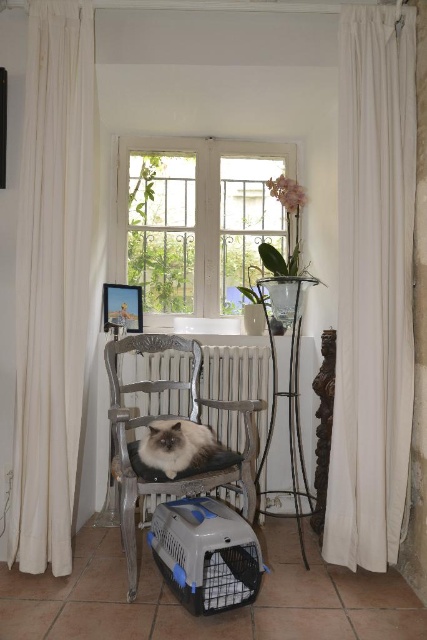
Question: Based on their relative distances, which object is farther from the gray plastic pet carrier at lower center?

Choices:
 (A) white sheer curtain at right
 (B) white sheer curtain at left
 (C) white glass window at center
 (D) white metallic radiator at center

Answer: (C)

Question: Is white sheer curtain at right wider than white glass window at center?

Choices:
 (A) no
 (B) yes

Answer: (A)

Question: Does white sheer curtain at left appear on the left side of gray plastic pet carrier at lower center?

Choices:
 (A) no
 (B) yes

Answer: (B)

Question: Which object is the farthest from the white glass window at center?

Choices:
 (A) white sheer curtain at right
 (B) gray plastic pet carrier at lower center

Answer: (B)

Question: Estimate the real-world distances between objects in this image. Which object is closer to the white sheer curtain at left?

Choices:
 (A) gray plastic pet carrier at lower center
 (B) fluffy gray cat at center
 (C) white glass window at center
 (D) white metallic radiator at center

Answer: (B)

Question: Can you confirm if white sheer curtain at right is positioned below white metallic radiator at center?

Choices:
 (A) no
 (B) yes

Answer: (A)